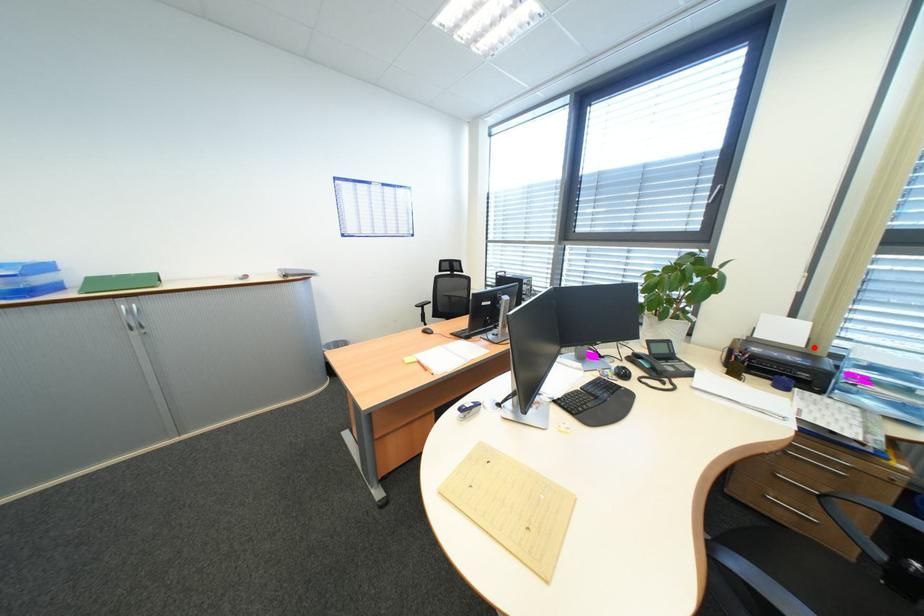
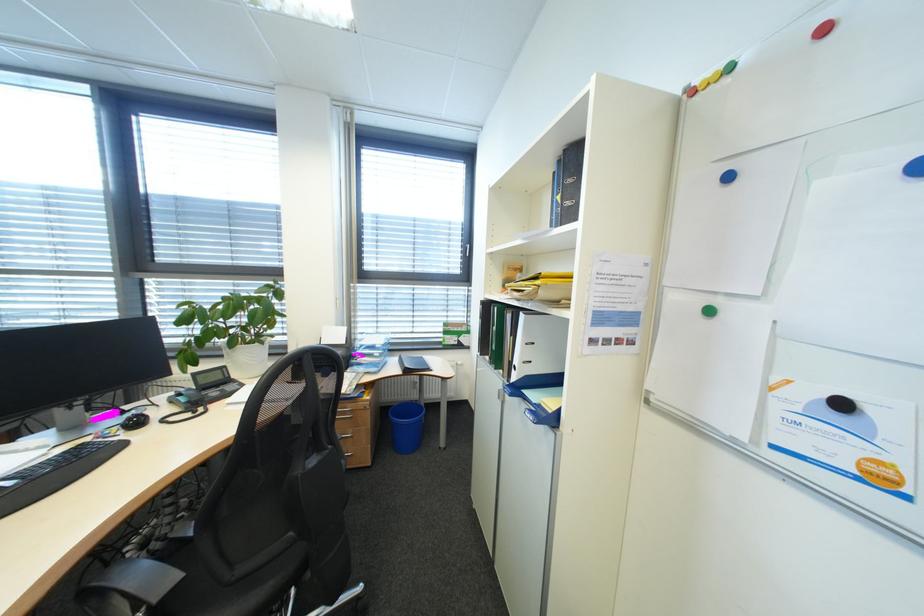
Question: A red point is marked in image1. In image2, is the corresponding 3D point closer to the camera or farther? Reply with the corresponding letter.

Choices:
 (A) The corresponding 3D point is closer.
 (B) The corresponding 3D point is farther.

Answer: (A)